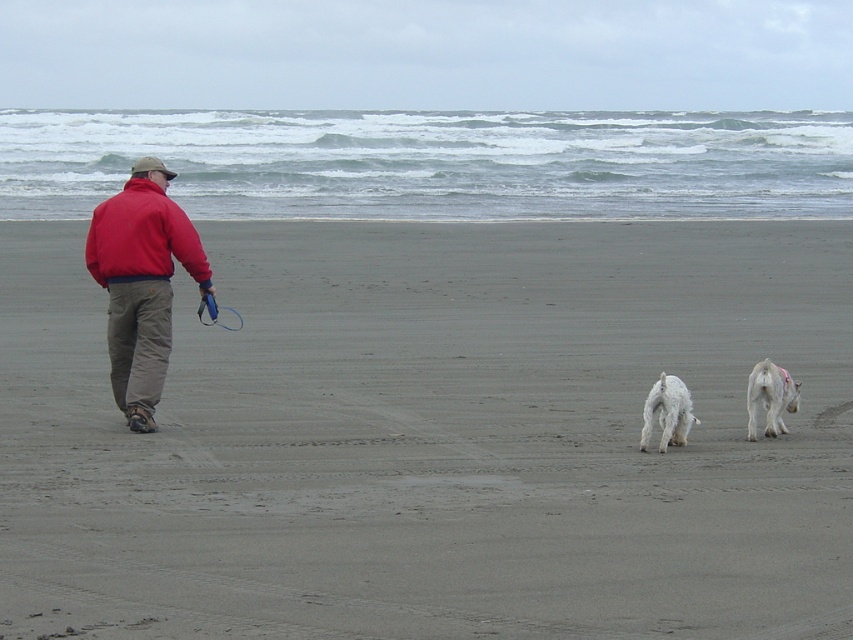
Question: Which point is farther from the camera taking this photo?

Choices:
 (A) (271, 604)
 (B) (149, 288)
 (C) (747, 433)
 (D) (131, 259)

Answer: (C)

Question: Which object appears closest to the camera in this image?

Choices:
 (A) white fluffy dog at right
 (B) red fleece sweatshirt at left
 (C) red fleece jacket at left

Answer: (A)

Question: Can you confirm if gray sand at center is positioned to the left of red fleece jacket at left?

Choices:
 (A) no
 (B) yes

Answer: (A)

Question: Which object appears farthest from the camera in this image?

Choices:
 (A) red fleece jacket at left
 (B) white fluffy dog at right
 (C) gray sand at center

Answer: (A)

Question: Does red fleece jacket at left have a larger size compared to white fluffy dog at center?

Choices:
 (A) yes
 (B) no

Answer: (A)

Question: Where is white fluffy dog at right located in relation to white fluffy dog at center in the image?

Choices:
 (A) below
 (B) above

Answer: (A)